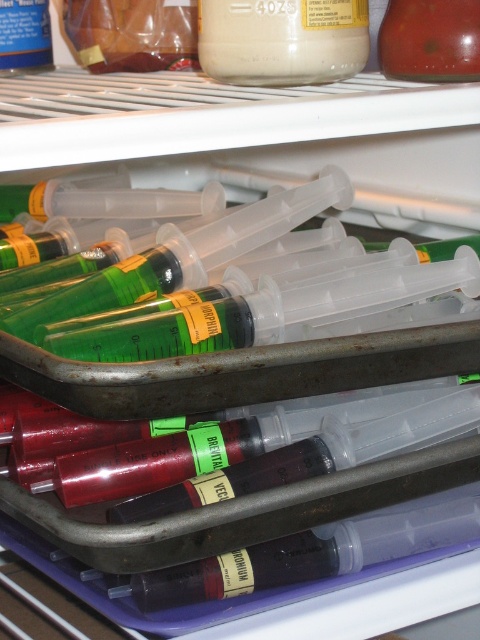
Question: Does translucent plastic bottles at upper left have a greater width compared to shiny red apple at upper right?

Choices:
 (A) yes
 (B) no

Answer: (A)

Question: Can you confirm if shiny red apple at upper right is smaller than translucent plastic bottle at upper left?

Choices:
 (A) no
 (B) yes

Answer: (A)

Question: Which object is farther from the camera taking this photo?

Choices:
 (A) shiny red apple at upper right
 (B) translucent plastic bottle at upper left

Answer: (B)

Question: Can you confirm if translucent plastic bottles at upper left is thinner than translucent plastic bottle at upper left?

Choices:
 (A) yes
 (B) no

Answer: (B)

Question: Which is farther from the translucent plastic bottle at upper left?

Choices:
 (A) shiny red apple at upper right
 (B) translucent plastic bottles at upper left

Answer: (A)

Question: Which object appears farthest from the camera in this image?

Choices:
 (A) translucent plastic bottles at upper left
 (B) translucent plastic bottle at upper left
 (C) shiny red apple at upper right

Answer: (A)